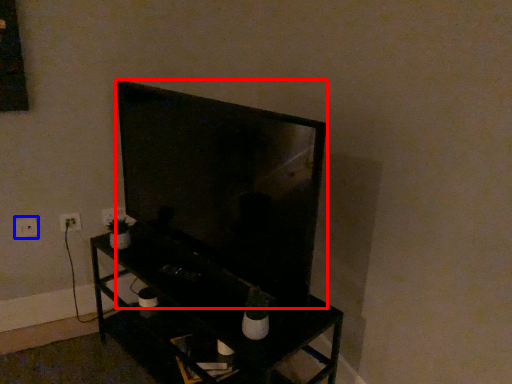
Question: Among these objects, which one is farthest to the camera, television (highlighted by a red box) or electric outlet (highlighted by a blue box)?

Choices:
 (A) television
 (B) electric outlet

Answer: (B)